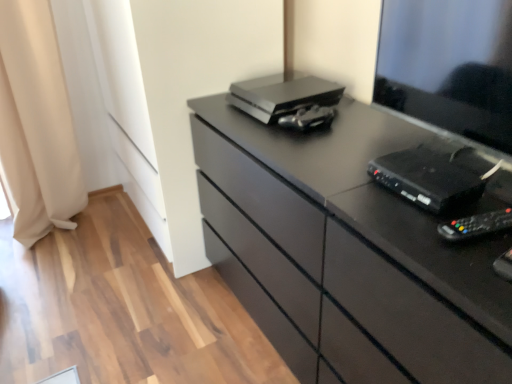
Question: Is matte black chest of drawers at center spatially inside black plastic device at right, which appears as the 2th equipment when ordered from the bottom, or outside of it?

Choices:
 (A) outside
 (B) inside

Answer: (A)

Question: From their relative heights in the image, would you say matte black chest of drawers at center is taller or shorter than black plastic device at right, which ranks as the 2th equipment in front-to-back order?

Choices:
 (A) tall
 (B) short

Answer: (A)

Question: Which object is positioned farthest from the black plastic remote control at right, which is the 1th equipment from front to back?

Choices:
 (A) satin silver printer at upper center
 (B) black plastic device at right, which is the 2th equipment in top-to-bottom order
 (C) matte black chest of drawers at center
 (D) beige fabric curtain at left
 (E) black plastic desktop at right

Answer: (D)

Question: Which object is the farthest from the metallic silver game controller at center, placed as the first equipment when sorted from top to bottom?

Choices:
 (A) black plastic remote control at right, acting as the 3th equipment starting from the back
 (B) matte black chest of drawers at center
 (C) satin silver printer at upper center
 (D) black plastic device at right, which ranks as the 2th equipment in front-to-back order
 (E) beige fabric curtain at left

Answer: (E)